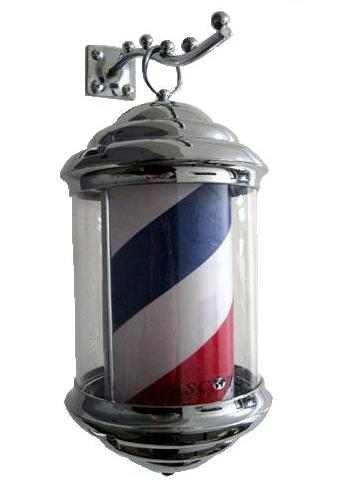
Image resolution: width=358 pixels, height=497 pixels. I want to click on wall mount, so click(x=103, y=54).